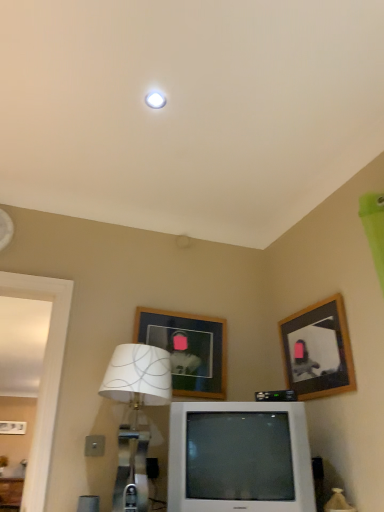
Image resolution: width=384 pixels, height=512 pixels. What do you see at coordinates (187, 349) in the screenshot? I see `wooden picture frame at upper center, which appears as the 2th picture frame when viewed from the right` at bounding box center [187, 349].

Find the location of a particular element. wooden picture frame at upper center, which appears as the 2th picture frame when viewed from the right is located at coordinates (187, 349).

From the image's perspective, which one is positioned higher, wooden picture frame at upper center, the first picture frame from the left, or white fabric lampshade at lower center?

From the image's view, wooden picture frame at upper center, the first picture frame from the left, is above.

In the scene shown: Can you confirm if wooden picture frame at upper center, which appears as the 2th picture frame when viewed from the right, is positioned to the left of white fabric lampshade at lower center?

Incorrect, wooden picture frame at upper center, which appears as the 2th picture frame when viewed from the right, is not on the left side of white fabric lampshade at lower center.

Is wooden picture frame at upper center, which appears as the 2th picture frame when viewed from the right, far away from white fabric lampshade at lower center?

No, wooden picture frame at upper center, which appears as the 2th picture frame when viewed from the right, is not far from white fabric lampshade at lower center.

Can you tell me how much wooden picture frame at upper center, the first picture frame from the left, and white fabric lampshade at lower center differ in facing direction?

The angle between the facing direction of wooden picture frame at upper center, the first picture frame from the left, and the facing direction of white fabric lampshade at lower center is 13 degrees.

Which is less distant, [208,442] or [151,321]?

Point [208,442].

Is the position of white plastic television at center more distant than that of wooden picture frame at upper center, the first picture frame from the left?

No, white plastic television at center is in front of wooden picture frame at upper center, the first picture frame from the left.

Are white plastic television at center and wooden picture frame at upper center, the first picture frame from the left, located far from each other?

Actually, white plastic television at center and wooden picture frame at upper center, the first picture frame from the left, are a little close together.

Based on the photo, can you confirm if white plastic television at center is positioned to the left of wooden picture frame at upper center, the first picture frame from the left?

No, white plastic television at center is not to the left of wooden picture frame at upper center, the first picture frame from the left.

From the image's perspective, between white plastic television at center and wooden picture frame at upper right, which is counted as the second picture frame, starting from the left, who is located below?

white plastic television at center appears lower in the image.

You are a GUI agent. You are given a task and a screenshot of the screen. Output one action in this format:
    pyautogui.click(x=<x>, y=<y>)
    Task: Click on the 1st picture frame located above the white plastic television at center (from a real-world perspective)
    This screenshot has height=512, width=384.
    Given the screenshot: What is the action you would take?
    pyautogui.click(x=318, y=350)

Is the position of white plastic television at center less distant than that of wooden picture frame at upper right, which is counted as the second picture frame, starting from the left?

Yes, it is in front of wooden picture frame at upper right, which is counted as the second picture frame, starting from the left.

Can you tell me how much white plastic television at center and wooden picture frame at upper right, the first picture frame from the right, differ in facing direction?

They differ by 63.6 degrees in their facing directions.

The width and height of the screenshot is (384, 512). I want to click on television that appears behind the white fabric lampshade at lower center, so click(x=239, y=457).

Considering the positions of objects white fabric lampshade at lower center and white plastic television at center in the image provided, who is more to the right, white fabric lampshade at lower center or white plastic television at center?

From the viewer's perspective, white plastic television at center appears more on the right side.

Between white fabric lampshade at lower center and white plastic television at center, which one has larger width?

white fabric lampshade at lower center is wider.

How much distance is there between wooden picture frame at upper center, which appears as the 2th picture frame when viewed from the right, and white plastic television at center?

wooden picture frame at upper center, which appears as the 2th picture frame when viewed from the right, is 20.98 inches away from white plastic television at center.

Between wooden picture frame at upper center, the first picture frame from the left, and white plastic television at center, which one appears on the right side from the viewer's perspective?

white plastic television at center.

From the image's perspective, which is below, wooden picture frame at upper center, which appears as the 2th picture frame when viewed from the right, or white plastic television at center?

From the image's view, white plastic television at center is below.

Considering the sizes of objects wooden picture frame at upper center, which appears as the 2th picture frame when viewed from the right, and white plastic television at center in the image provided, who is shorter, wooden picture frame at upper center, which appears as the 2th picture frame when viewed from the right, or white plastic television at center?

wooden picture frame at upper center, which appears as the 2th picture frame when viewed from the right.

Where is `table lamp above the white plastic television at center (from a real-world perspective)`? table lamp above the white plastic television at center (from a real-world perspective) is located at coordinates (135, 415).

Does white plastic television at center lie behind white fabric lampshade at lower center?

That is True.

Is white plastic television at center looking in the opposite direction of white fabric lampshade at lower center?

white plastic television at center does not have its back to white fabric lampshade at lower center.

Is wooden picture frame at upper right, the first picture frame from the right, turned away from white plastic television at center?

wooden picture frame at upper right, the first picture frame from the right, is not turned away from white plastic television at center.

Is wooden picture frame at upper right, the first picture frame from the right, far away from white plastic television at center?

Actually, wooden picture frame at upper right, the first picture frame from the right, and white plastic television at center are a little close together.

From a real-world perspective, between wooden picture frame at upper right, the first picture frame from the right, and white plastic television at center, who is vertically lower?

From a 3D spatial view, white plastic television at center is below.

The width and height of the screenshot is (384, 512). In order to click on table lamp to the left of wooden picture frame at upper center, the first picture frame from the left in this screenshot , I will do `click(135, 415)`.

From the image's perspective, starting from the white plastic television at center, which picture frame is the 1st one above? Please provide its 2D coordinates.

[(187, 349)]

Based on their spatial positions, is white plastic television at center or white fabric lampshade at lower center closer to wooden picture frame at upper right, the first picture frame from the right?

white plastic television at center is closer to wooden picture frame at upper right, the first picture frame from the right.

Looking at the image, which one is located further to wooden picture frame at upper center, which appears as the 2th picture frame when viewed from the right, white plastic television at center or wooden picture frame at upper right, which is counted as the second picture frame, starting from the left?

wooden picture frame at upper right, which is counted as the second picture frame, starting from the left, lies further to wooden picture frame at upper center, which appears as the 2th picture frame when viewed from the right, than the other object.

Considering their positions, is white plastic television at center positioned closer to wooden picture frame at upper right, which is counted as the second picture frame, starting from the left, than wooden picture frame at upper center, which appears as the 2th picture frame when viewed from the right?

white plastic television at center is positioned closer to the anchor wooden picture frame at upper right, which is counted as the second picture frame, starting from the left.

From the image, which object appears to be farther from white plastic television at center, white fabric lampshade at lower center or wooden picture frame at upper center, which appears as the 2th picture frame when viewed from the right?

wooden picture frame at upper center, which appears as the 2th picture frame when viewed from the right, is further to white plastic television at center.

Looking at this image, when comparing their distances from white fabric lampshade at lower center, does wooden picture frame at upper right, the first picture frame from the right, or white plastic television at center seem further?

wooden picture frame at upper right, the first picture frame from the right, lies further to white fabric lampshade at lower center than the other object.

Looking at the image, which one is located closer to wooden picture frame at upper center, which appears as the 2th picture frame when viewed from the right, white plastic television at center or white fabric lampshade at lower center?

Among the two, white fabric lampshade at lower center is located nearer to wooden picture frame at upper center, which appears as the 2th picture frame when viewed from the right.

Looking at the image, which one is located closer to wooden picture frame at upper right, the first picture frame from the right, white fabric lampshade at lower center or wooden picture frame at upper center, the first picture frame from the left?

wooden picture frame at upper center, the first picture frame from the left.

Consider the image. Considering their positions, is white fabric lampshade at lower center positioned further to white plastic television at center than wooden picture frame at upper right, which is counted as the second picture frame, starting from the left?

wooden picture frame at upper right, which is counted as the second picture frame, starting from the left, is positioned further to the anchor white plastic television at center.

Image resolution: width=384 pixels, height=512 pixels. I want to click on television between white fabric lampshade at lower center and wooden picture frame at upper center, the first picture frame from the left, along the z-axis, so click(x=239, y=457).

Find the location of a particular element. Image resolution: width=384 pixels, height=512 pixels. television situated between white fabric lampshade at lower center and wooden picture frame at upper right, which is counted as the second picture frame, starting from the left, from left to right is located at coordinates (239, 457).

The image size is (384, 512). I want to click on picture frame located between white fabric lampshade at lower center and wooden picture frame at upper right, which is counted as the second picture frame, starting from the left, in the left-right direction, so click(x=187, y=349).

Locate an element on the screen. television between wooden picture frame at upper center, the first picture frame from the left, and wooden picture frame at upper right, the first picture frame from the right is located at coordinates (239, 457).